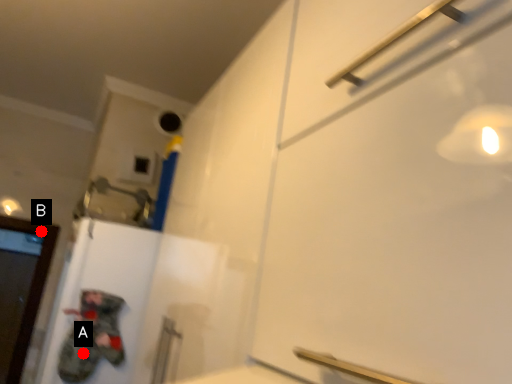
Question: Two points are circled on the image, labeled by A and B beside each circle. Which point appears farthest from the camera in this image?

Choices:
 (A) A is further
 (B) B is further

Answer: (B)